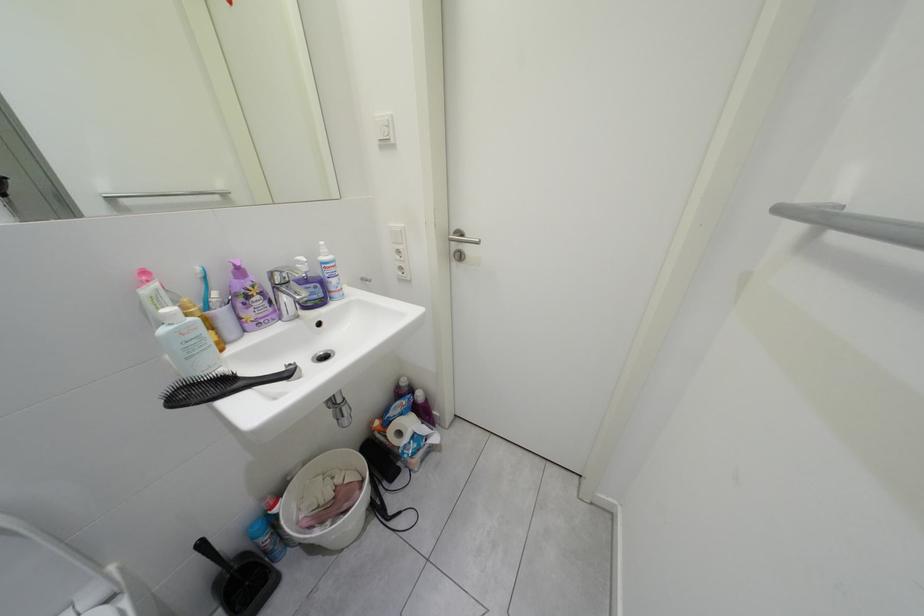
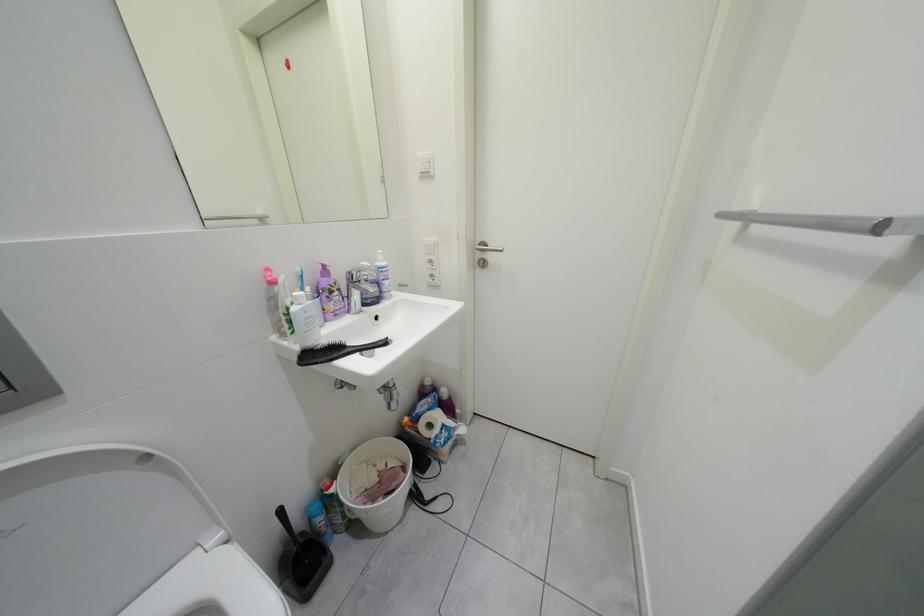
Question: How did the camera likely rotate?

Choices:
 (A) Left
 (B) Right
 (C) Up
 (D) Down

Answer: (C)